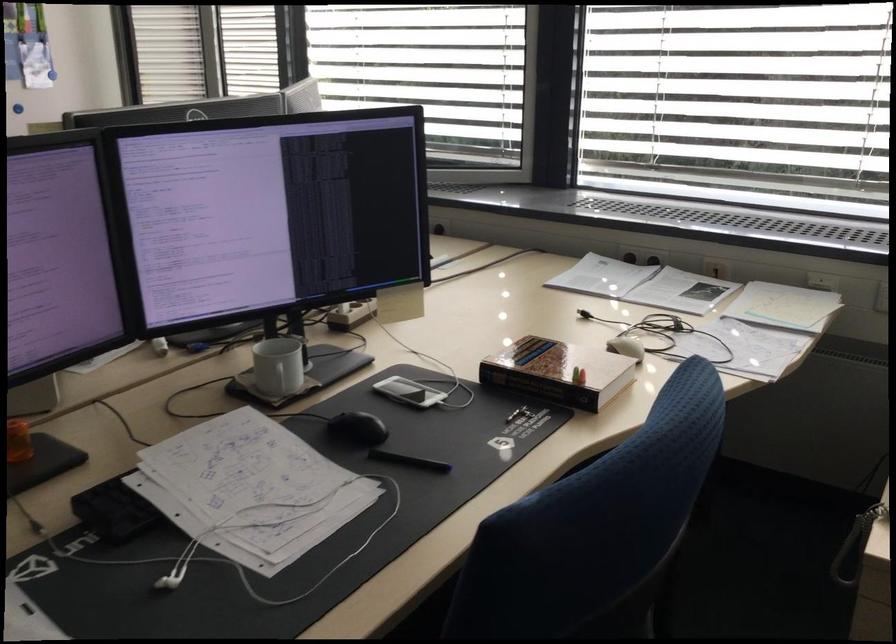
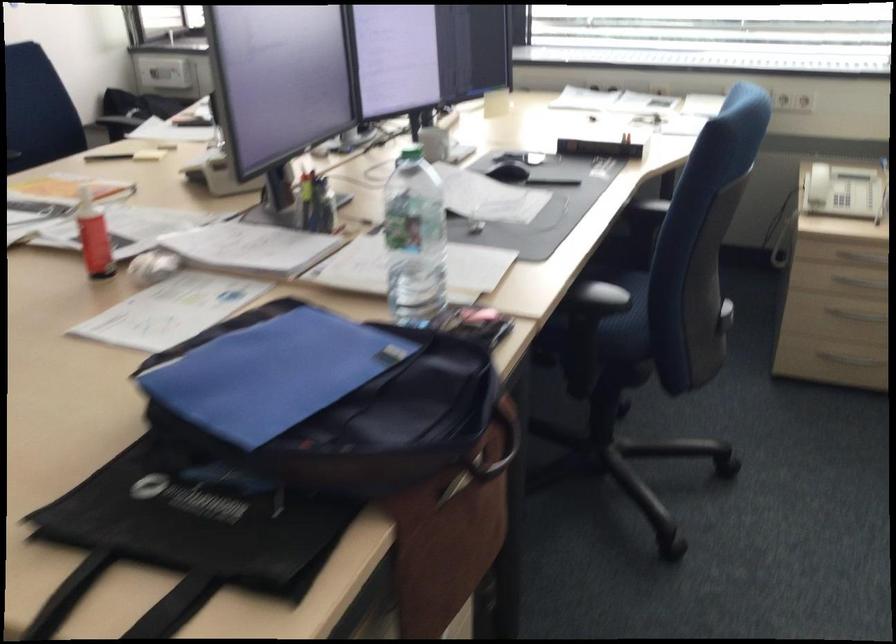
The point at [354,439] is marked in the first image. Where is the corresponding point in the second image?

(509, 172)